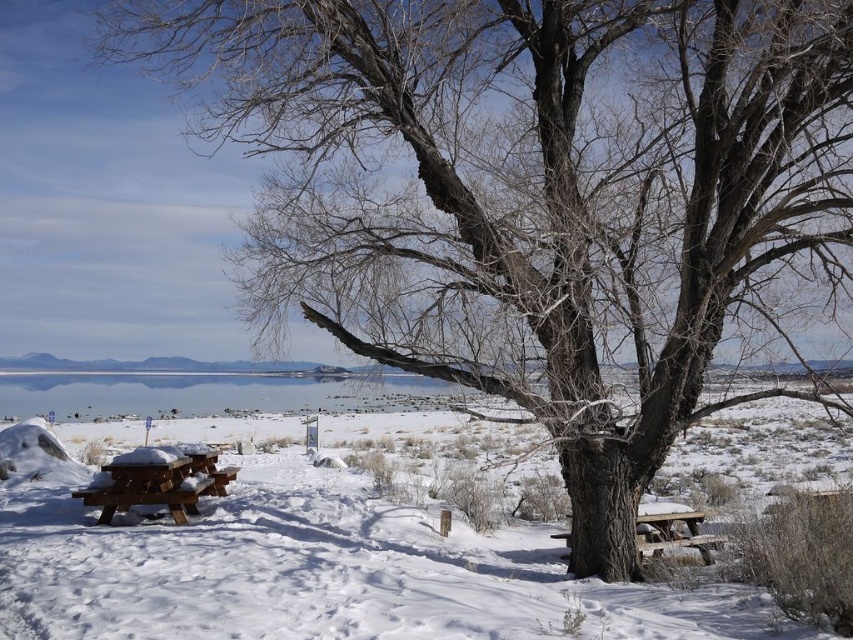
Question: Is brown wooden picnic table at lower left below wooden picnic table at lower right?

Choices:
 (A) yes
 (B) no

Answer: (B)

Question: Among these points, which one is nearest to the camera?

Choices:
 (A) (705, 550)
 (B) (193, 477)

Answer: (A)

Question: Which of the following is the farthest from the observer?

Choices:
 (A) white powdery snow at lower left
 (B) brown wooden picnic table at lower left
 (C) wooden picnic table at lower right

Answer: (C)

Question: Can you confirm if white powdery snow at lower left is positioned to the left of wooden picnic table at lower right?

Choices:
 (A) no
 (B) yes

Answer: (B)

Question: Is brown wooden picnic table at lower left below wooden picnic table at lower right?

Choices:
 (A) yes
 (B) no

Answer: (B)

Question: Which object is the farthest from the brown wooden picnic table at lower left?

Choices:
 (A) white powdery snow at lower left
 (B) wooden picnic table at lower right

Answer: (B)